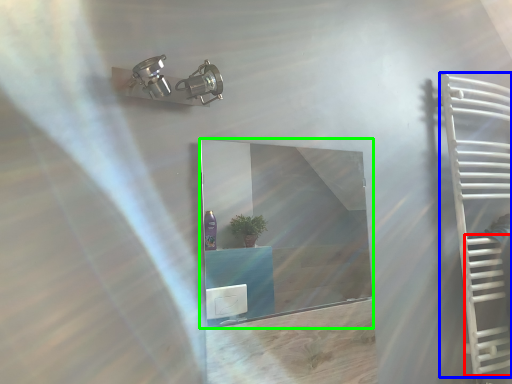
Question: Which object is positioned closest to stairs (highlighted by a red box)? Select from ladder (highlighted by a blue box) and mirror (highlighted by a green box).

Choices:
 (A) ladder
 (B) mirror

Answer: (A)